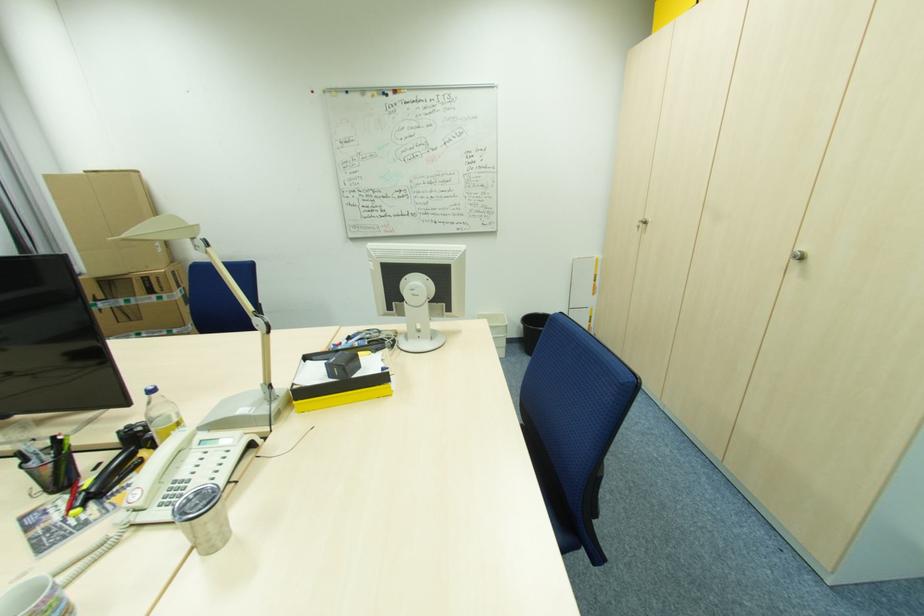
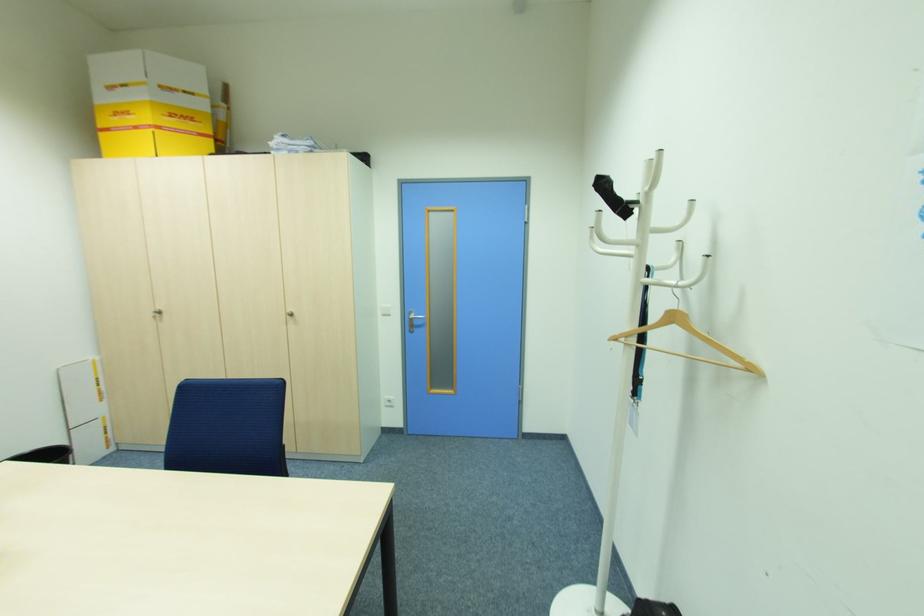
In the second image, find the point that corresponds to pixel 649 223 in the first image.

(162, 312)